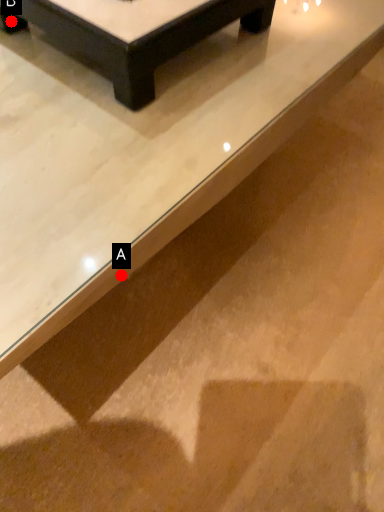
Question: Two points are circled on the image, labeled by A and B beside each circle. Which point is closer to the camera?

Choices:
 (A) A is closer
 (B) B is closer

Answer: (A)